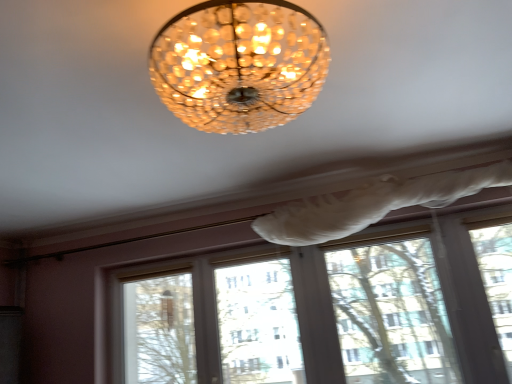
What is the approximate width of matte glass chandelier at center?

17.44 inches.

This screenshot has height=384, width=512. Describe the element at coordinates (239, 64) in the screenshot. I see `matte glass chandelier at center` at that location.

This screenshot has width=512, height=384. Find the location of `matte glass chandelier at center`. matte glass chandelier at center is located at coordinates (239, 64).

Locate an element on the screen. white plastic window frame at lower right is located at coordinates (391, 313).

Measure the distance between white plastic window frame at lower right and camera.

white plastic window frame at lower right is 7.77 feet from camera.

This screenshot has height=384, width=512. What do you see at coordinates (391, 313) in the screenshot? I see `white plastic window frame at lower right` at bounding box center [391, 313].

Where is `matte glass chandelier at center`? matte glass chandelier at center is located at coordinates (239, 64).

Visually, is matte glass chandelier at center positioned to the left or to the right of white plastic window frame at lower right?

matte glass chandelier at center is positioned on white plastic window frame at lower right's left side.

Which object is further away from the camera, matte glass chandelier at center or white plastic window frame at lower right?

white plastic window frame at lower right.

Considering the positions of point (167, 92) and point (390, 327), is point (167, 92) closer or farther from the camera than point (390, 327)?

Point (167, 92).

From the image's perspective, which one is positioned lower, matte glass chandelier at center or white plastic window frame at lower right?

white plastic window frame at lower right.

Looking at this image, from a real-world perspective, is matte glass chandelier at center located higher than white plastic window frame at lower right?

Yes, from a real-world perspective, matte glass chandelier at center is above white plastic window frame at lower right.

Does matte glass chandelier at center have a lesser width compared to white plastic window frame at lower right?

In fact, matte glass chandelier at center might be wider than white plastic window frame at lower right.

Between matte glass chandelier at center and white plastic window frame at lower right, which one has more height?

white plastic window frame at lower right is taller.

Is matte glass chandelier at center bigger or smaller than white plastic window frame at lower right?

matte glass chandelier at center is bigger than white plastic window frame at lower right.

Would you say matte glass chandelier at center is outside white plastic window frame at lower right?

That's correct, matte glass chandelier at center is outside of white plastic window frame at lower right.

Is there a large distance between matte glass chandelier at center and white plastic window frame at lower right?

That's right, there is a large distance between matte glass chandelier at center and white plastic window frame at lower right.

Is matte glass chandelier at center aimed at white plastic window frame at lower right?

No, matte glass chandelier at center is not turned towards white plastic window frame at lower right.

Can you tell me how much matte glass chandelier at center and white plastic window frame at lower right differ in facing direction?

1.86 degrees.

Identify the location of lamp located above the white plastic window frame at lower right (from a real-world perspective). (239, 64).

Between white plastic window frame at lower right and matte glass chandelier at center, which one appears on the left side from the viewer's perspective?

matte glass chandelier at center is more to the left.

Is white plastic window frame at lower right further to the viewer compared to matte glass chandelier at center?

Yes, the depth of white plastic window frame at lower right is greater than that of matte glass chandelier at center.

Does point (360, 335) come closer to viewer compared to point (198, 4)?

No, (360, 335) is further to viewer.

From the image's perspective, is white plastic window frame at lower right above or below matte glass chandelier at center?

white plastic window frame at lower right is situated lower than matte glass chandelier at center in the image.

From a real-world perspective, is white plastic window frame at lower right above or below matte glass chandelier at center?

white plastic window frame at lower right is below matte glass chandelier at center.

Looking at their sizes, would you say white plastic window frame at lower right is wider or thinner than matte glass chandelier at center?

white plastic window frame at lower right is thinner than matte glass chandelier at center.

Based on the photo, which of these two, white plastic window frame at lower right or matte glass chandelier at center, stands taller?

white plastic window frame at lower right.

Considering the sizes of white plastic window frame at lower right and matte glass chandelier at center in the image, is white plastic window frame at lower right bigger or smaller than matte glass chandelier at center?

white plastic window frame at lower right is smaller than matte glass chandelier at center.

Would you say white plastic window frame at lower right is inside or outside matte glass chandelier at center?

white plastic window frame at lower right exists outside the volume of matte glass chandelier at center.

Would you consider white plastic window frame at lower right to be distant from matte glass chandelier at center?

Yes, white plastic window frame at lower right and matte glass chandelier at center are located far from each other.

Is white plastic window frame at lower right positioned with its back to matte glass chandelier at center?

white plastic window frame at lower right does not have its back to matte glass chandelier at center.

Can you tell me how much white plastic window frame at lower right and matte glass chandelier at center differ in facing direction?

The angle between the facing direction of white plastic window frame at lower right and the facing direction of matte glass chandelier at center is 1.86 degrees.

How far apart are white plastic window frame at lower right and matte glass chandelier at center?

white plastic window frame at lower right is 6.19 feet away from matte glass chandelier at center.

Identify the location of lamp that is above the white plastic window frame at lower right (from a real-world perspective). (239, 64).

Identify the location of lamp above the white plastic window frame at lower right (from the image's perspective). This screenshot has width=512, height=384. (239, 64).

The width and height of the screenshot is (512, 384). Identify the location of lamp lying on the left of white plastic window frame at lower right. (239, 64).